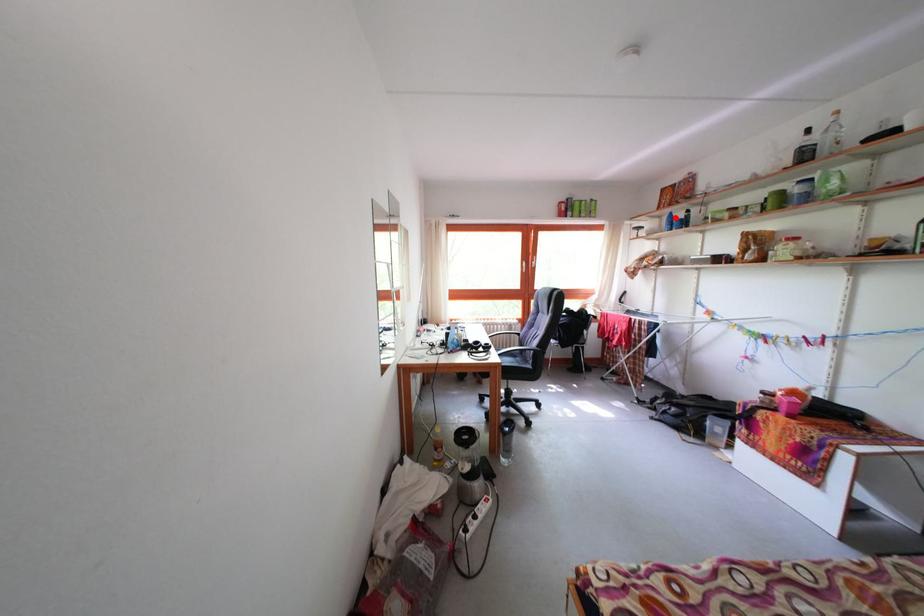
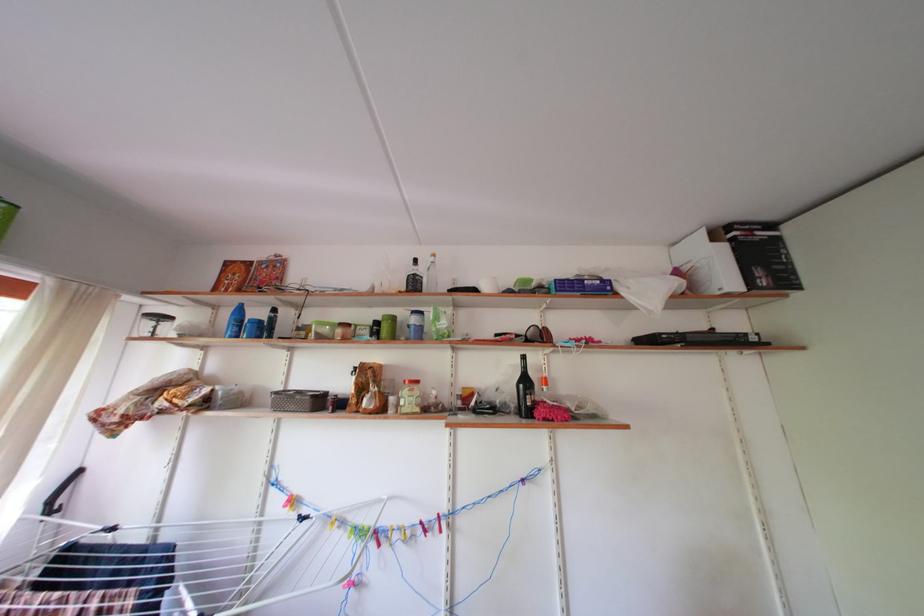
The point at the highlighted location is marked in the first image. Where is the corresponding point in the second image?

(242, 305)